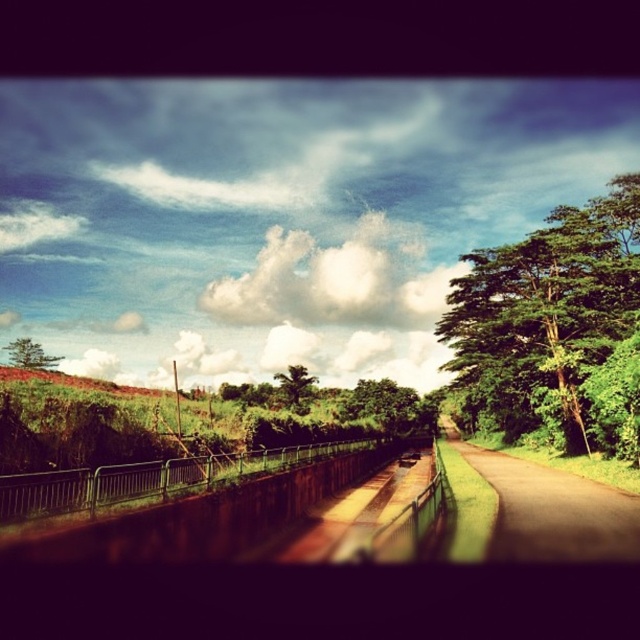
Is brown asphalt road at center positioned in front of green leafy tree at left?

Yes, it is.

Between brown asphalt road at center and green leafy tree at left, which one is positioned higher?

green leafy tree at left

The image size is (640, 640). In order to click on brown asphalt road at center in this screenshot , I will do point(550,509).

Image resolution: width=640 pixels, height=640 pixels. Identify the location of brown asphalt road at center. (550, 509).

Does white fluffy cloud at upper center have a lesser height compared to green leafy tree at left?

No, white fluffy cloud at upper center is not shorter than green leafy tree at left.

Is white fluffy cloud at upper center positioned at the back of green leafy tree at left?

Yes, white fluffy cloud at upper center is further from the viewer.

Image resolution: width=640 pixels, height=640 pixels. I want to click on white fluffy cloud at upper center, so point(333,280).

The image size is (640, 640). Identify the location of white fluffy cloud at upper center. (333, 280).

Looking at this image, is green leafy tree at right positioned before green leafy tree at center?

Yes, green leafy tree at right is closer to the viewer.

Is point (611, 324) positioned after point (301, 384)?

No, (611, 324) is closer to viewer.

At what (x,y) coordinates should I click in order to perform the action: click on green leafy tree at right. Please return your answer as a coordinate pair (x, y). Looking at the image, I should click on (545, 314).